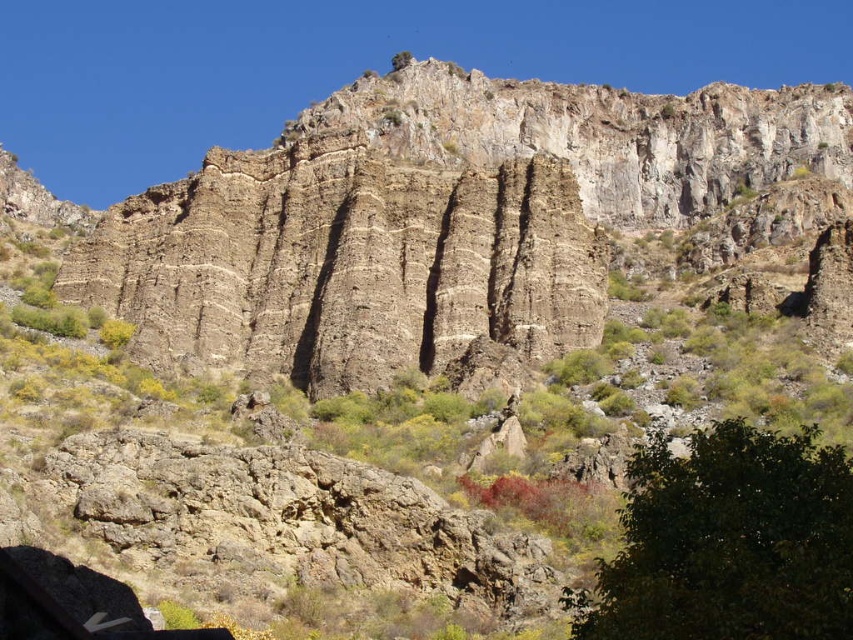
Question: Does brown rough rock face at center appear on the right side of green leafy tree at lower right?

Choices:
 (A) no
 (B) yes

Answer: (A)

Question: Does brown rough rock face at center appear under green leafy tree at lower right?

Choices:
 (A) yes
 (B) no

Answer: (B)

Question: Which object is farther from the camera taking this photo?

Choices:
 (A) brown rough rock face at center
 (B) green leafy tree at lower right

Answer: (A)

Question: Which point is farther to the camera?

Choices:
 (A) (271, 168)
 (B) (727, 516)

Answer: (A)

Question: Does brown rough rock face at center have a larger size compared to green leafy tree at lower right?

Choices:
 (A) yes
 (B) no

Answer: (A)

Question: Which point is farther to the camera?

Choices:
 (A) (347, 385)
 (B) (728, 496)

Answer: (A)